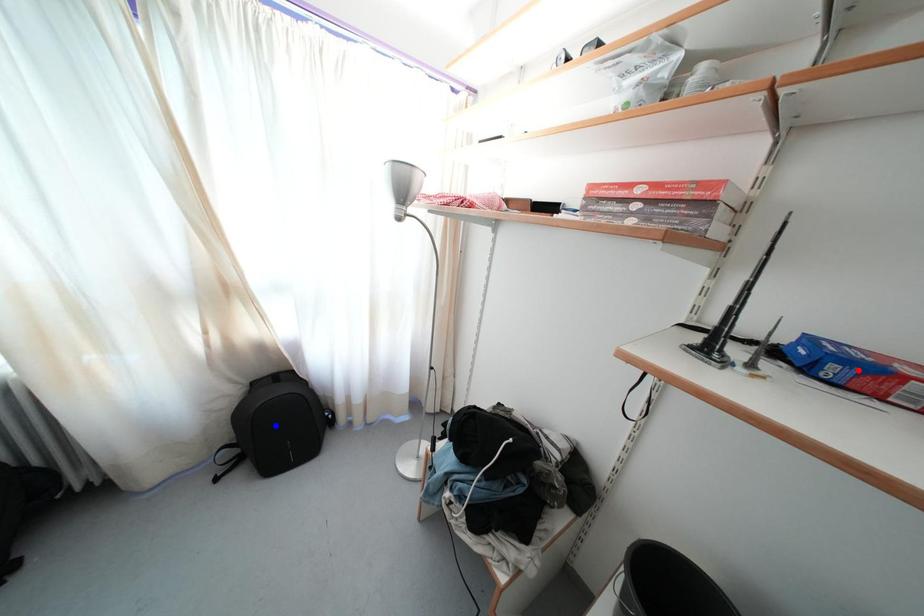
Question: Two points are marked on the image. Which point is closer to the camera?

Choices:
 (A) Blue point is closer.
 (B) Red point is closer.

Answer: (B)